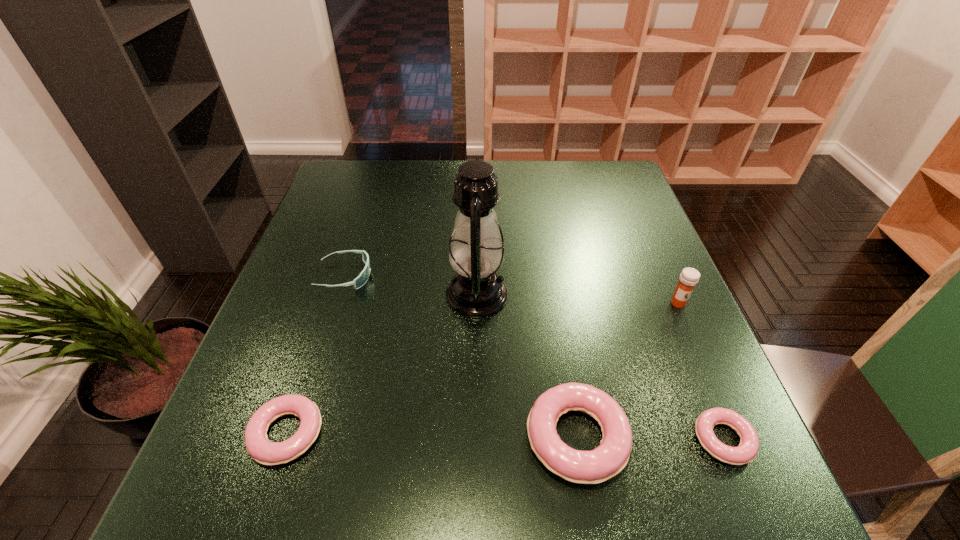
Where is `object located in the near right corner section of the desktop`? The height and width of the screenshot is (540, 960). object located in the near right corner section of the desktop is located at coordinates (747, 450).

In the image, there is a desktop. What are the coordinates of `vacant space at the far edge` in the screenshot? It's located at (430, 173).

At what (x,y) coordinates should I click in order to perform the action: click on vacant space at the near edge of the desktop. Please return your answer as a coordinate pair (x, y). Looking at the image, I should click on (478, 404).

In the image, there is a desktop. Identify the location of vacant space at the left edge. Image resolution: width=960 pixels, height=540 pixels. (324, 302).

In the image, there is a desktop. Find the location of `vacant space at the right edge`. vacant space at the right edge is located at coordinates (623, 241).

Where is `vacant space at the far left corner of the desktop`? The width and height of the screenshot is (960, 540). vacant space at the far left corner of the desktop is located at coordinates (328, 196).

Locate an element on the screen. blank area at the far right corner is located at coordinates click(x=623, y=188).

This screenshot has width=960, height=540. I want to click on free location at the near right corner of the desktop, so click(661, 447).

The image size is (960, 540). I want to click on empty location between the leftmost doughnut and the rightmost doughnut, so click(505, 437).

At what (x,y) coordinates should I click in order to perform the action: click on free space between the third object from right to left and the second tallest object. Please return your answer as a coordinate pair (x, y). This screenshot has height=540, width=960. Looking at the image, I should click on (628, 370).